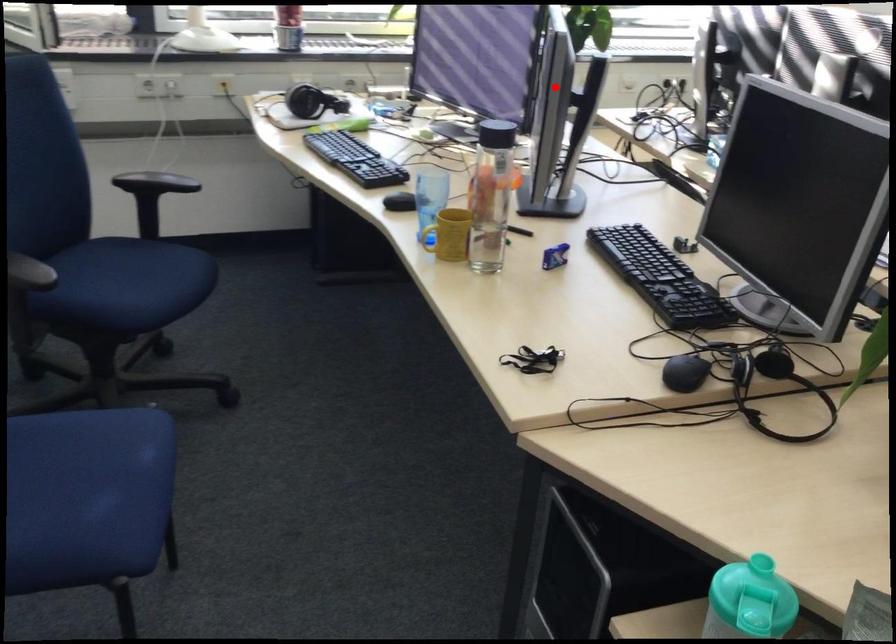
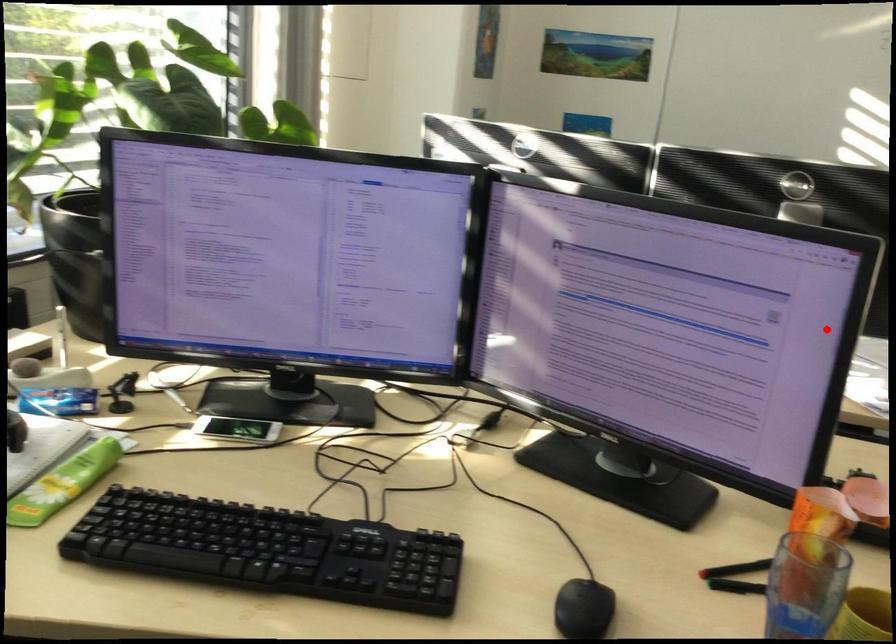
I am providing you with two images of the same scene from different viewpoints. A red point is marked on the first image and another point is marked on the second image. Is the red point in image1 aligned with the point shown in image2?

Yes